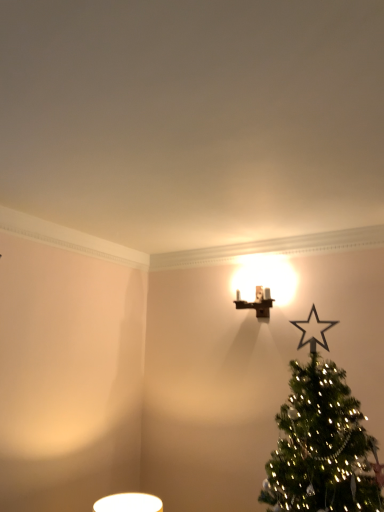
Question: Should I look upward or downward to see metallic gold sconce at upper center?

Choices:
 (A) up
 (B) down

Answer: (B)